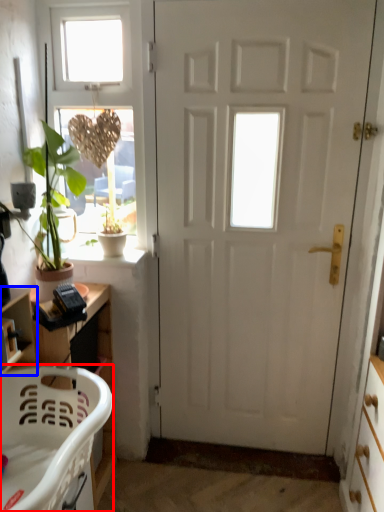
Question: Which object appears closest to the camera in this image, chair (highlighted by a red box) or shelf (highlighted by a blue box)?

Choices:
 (A) chair
 (B) shelf

Answer: (A)